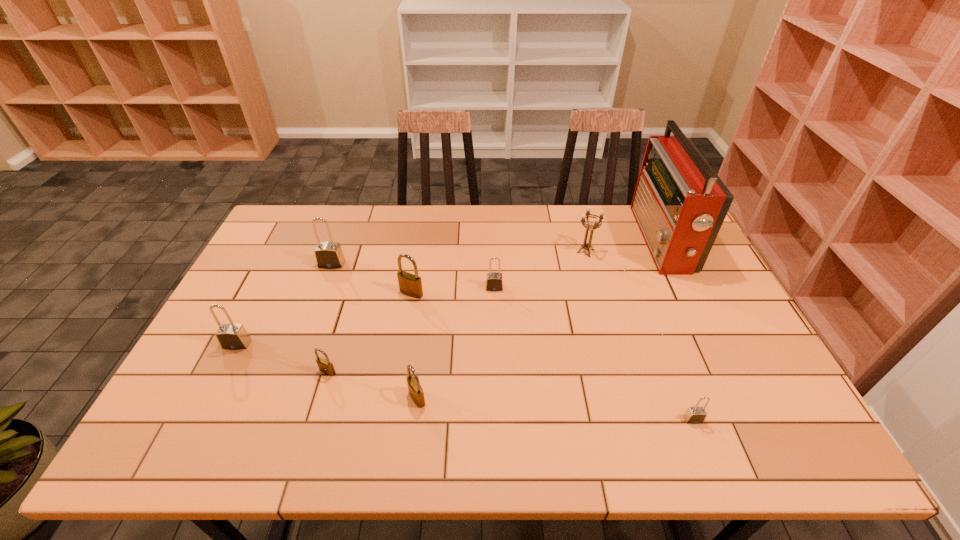
Select which padlock appears as the fourth closest to the sixth padlock from left to right. Please provide its 2D coordinates. Your answer should be formatted as a tuple, i.e. [(x, y)], where the tuple contains the x and y coordinates of a point satisfying the conditions above.

[(325, 366)]

Where is `the third closest padlock to the fifth padlock from right to left`? Image resolution: width=960 pixels, height=540 pixels. the third closest padlock to the fifth padlock from right to left is located at coordinates (409, 284).

Find the location of `gray padlock that stands as the closest to the second padlock from left to right`. gray padlock that stands as the closest to the second padlock from left to right is located at coordinates (231, 336).

Where is `gray padlock that is the third closest to the third object from right to left`? gray padlock that is the third closest to the third object from right to left is located at coordinates (329, 255).

Where is `brass padlock that can be found as the second closest to the leftmost brass padlock`? brass padlock that can be found as the second closest to the leftmost brass padlock is located at coordinates (409, 284).

Identify the location of brass padlock that is the second closest to the tallest object. (416, 392).

Locate an element on the screen. Image resolution: width=960 pixels, height=540 pixels. vacant point that satisfies the following two spatial constraints: 1. on the front-facing side of the rightmost object; 2. on the shackle of the farthest gray padlock is located at coordinates (673, 264).